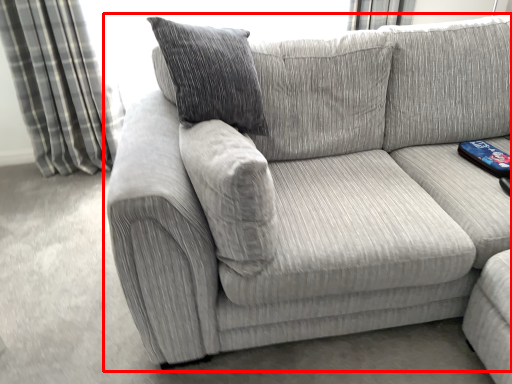
Question: In this image, where is studio couch (annotated by the red box) located relative to curtain?

Choices:
 (A) right
 (B) left

Answer: (A)